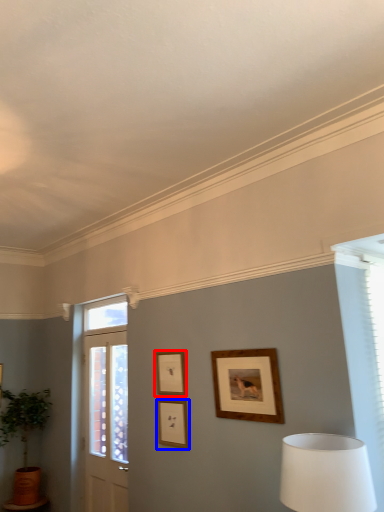
Question: Which of the following is the closest to the observer, picture frame (highlighted by a red box) or picture frame (highlighted by a blue box)?

Choices:
 (A) picture frame
 (B) picture frame

Answer: (B)